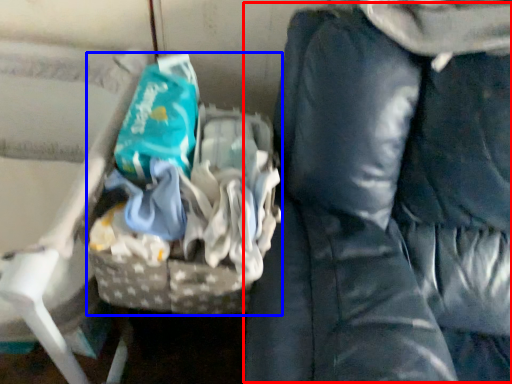
Question: Among these objects, which one is nearest to the camera, bean bag chair (highlighted by a red box) or waste (highlighted by a blue box)?

Choices:
 (A) bean bag chair
 (B) waste

Answer: (A)